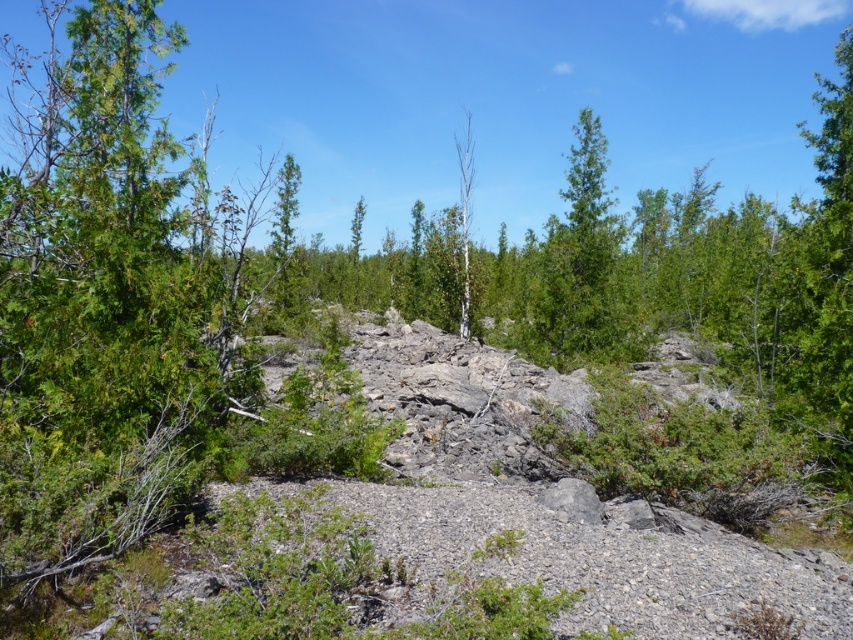
You are a hiker navigating through this rocky terrain and need to identify the wider tree to rest against. Which tree should you choose between the green matte tree at center and the white smooth tree at center?

The green matte tree at center is wider than the white smooth tree at center, so you should choose the green matte tree at center to rest against.

You are navigating through the rocky terrain and need to move from your current position to a destination. You notice two points marked on the map as point 1 at coordinates (280, 253) and point 2 at (463, 252). Which point is closer to your current position if you are standing at the starting point?

Point 1 at coordinates (280, 253) is closer to your current position because it is further to the viewer compared to point 2 at (463, 252).